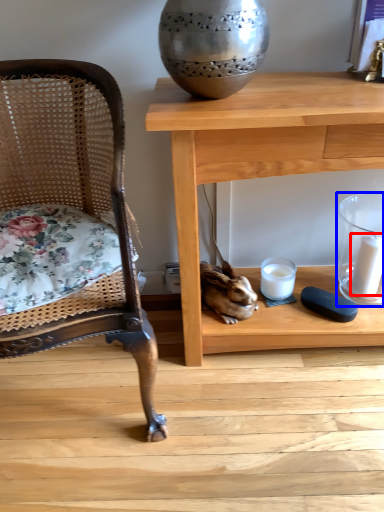
Question: Which object appears closest to the camera in this image, candle (highlighted by a red box) or candle holder (highlighted by a blue box)?

Choices:
 (A) candle
 (B) candle holder

Answer: (B)